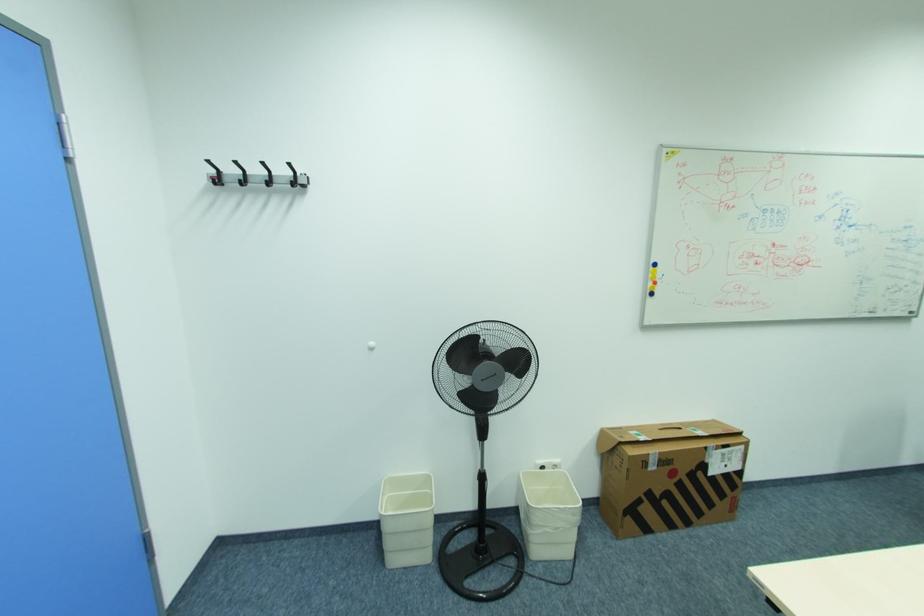
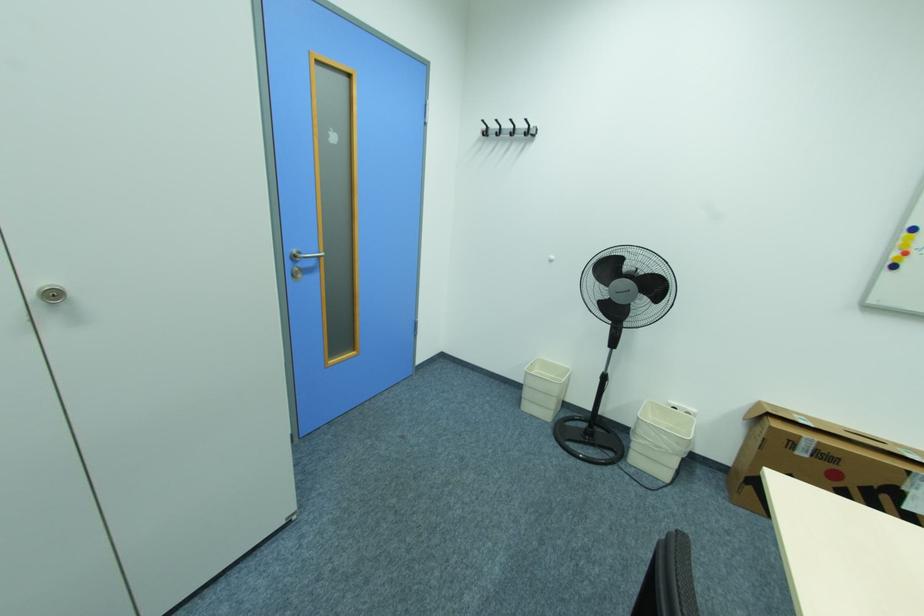
In the second image, find the point that corresponds to point 548,468 in the first image.

(679, 408)